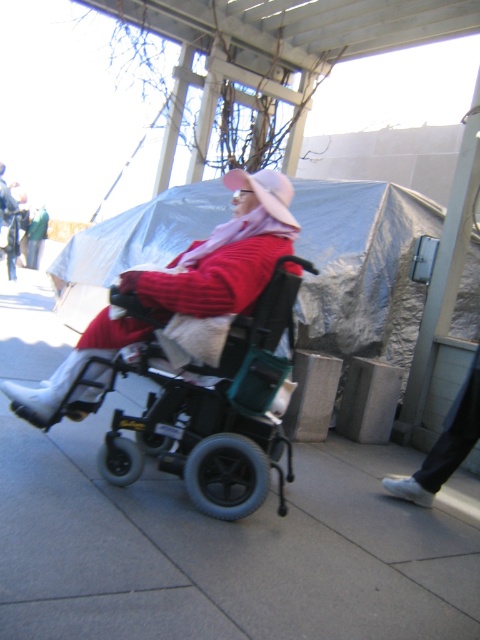
You are a caregiver trying to determine if the black plastic wheelchair at center can fit through a doorway that is the same height as the matte pink sweater at center. Based on the scene, will the wheelchair fit?

The black plastic wheelchair at center is not as tall as matte pink sweater at center, so it should fit through the doorway that is the same height as the matte pink sweater at center.

You are navigating an electric wheelchair and need to reach a destination located at point A. The gray concrete pavement at center is at point B. If point A is at point C, will you be able to travel directly from the wheelchair to point A without encountering any obstacles?

The gray concrete pavement at center is located at point B. Since point A is at point C, you can travel directly from the wheelchair to point A without encountering any obstacles as there are no objects mentioned between them in the scene description.

You are a delivery robot that needs to move from the gray concrete pavement at center to the black plastic wheelchair at center. Can you navigate directly between them?

The gray concrete pavement at center is positioned on the right side of black plastic wheelchair at center, so you can navigate directly between them since they are adjacent.